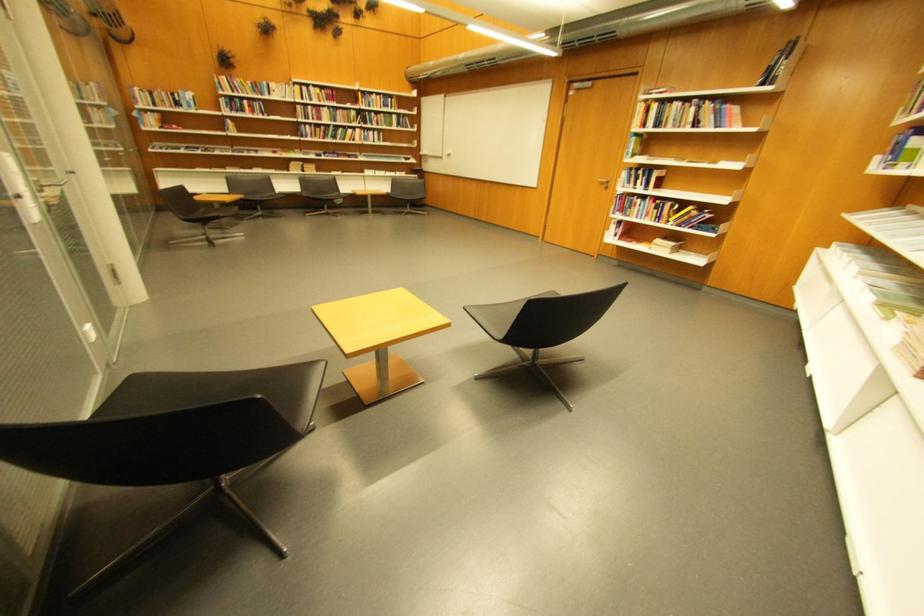
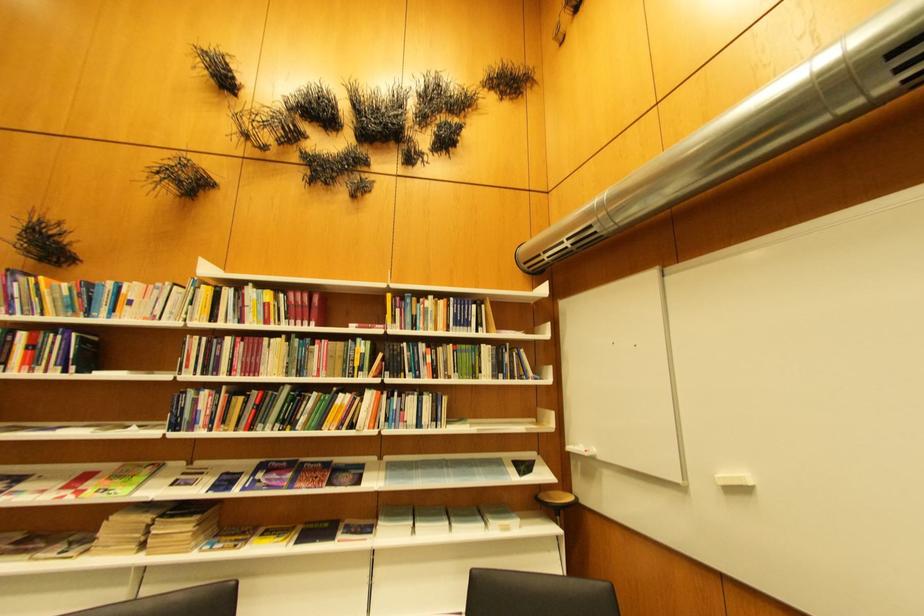
Locate, in the second image, the point that corresponds to point (408, 176) in the first image.

(506, 530)